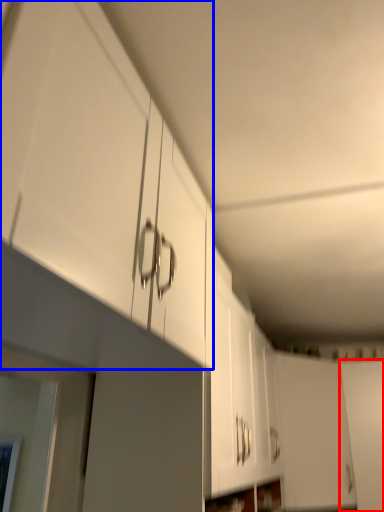
Question: Which point is closer to the camera, door (highlighted by a red box) or cabinetry (highlighted by a blue box)?

Choices:
 (A) door
 (B) cabinetry

Answer: (B)